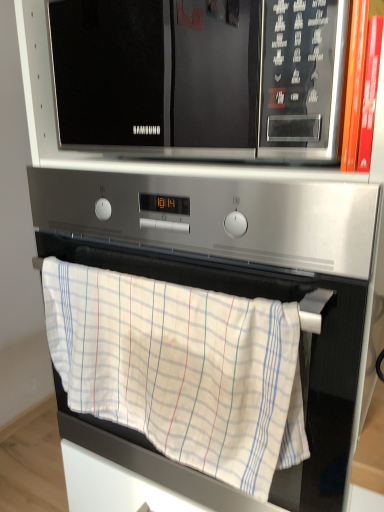
The height and width of the screenshot is (512, 384). Describe the element at coordinates (239, 270) in the screenshot. I see `satin silver oven at center` at that location.

The image size is (384, 512). What are the coordinates of `satin silver oven at center` in the screenshot? It's located at (239, 270).

The image size is (384, 512). Find the location of `black glossy microwave at upper center`. black glossy microwave at upper center is located at coordinates (202, 77).

Describe the element at coordinates (202, 77) in the screenshot. I see `black glossy microwave at upper center` at that location.

In order to face black glossy microwave at upper center, should I rotate leftwards or rightwards?

You should look right and rotate roughly 3.825 degrees.

Image resolution: width=384 pixels, height=512 pixels. Identify the location of satin silver oven at center. (239, 270).

Is black glossy microwave at upper center to the left of satin silver oven at center from the viewer's perspective?

Correct, you'll find black glossy microwave at upper center to the left of satin silver oven at center.

Considering the relative positions of black glossy microwave at upper center and satin silver oven at center in the image provided, is black glossy microwave at upper center in front of satin silver oven at center?

Yes, black glossy microwave at upper center is closer to the viewer.

Considering the points (121, 73) and (266, 238), which point is behind, point (121, 73) or point (266, 238)?

The point (121, 73) is more distant.

From the image's perspective, between black glossy microwave at upper center and satin silver oven at center, which one is located above?

black glossy microwave at upper center is shown above in the image.

From a real-world perspective, which is physically above, black glossy microwave at upper center or satin silver oven at center?

In real-world perspective, black glossy microwave at upper center is above.

Does black glossy microwave at upper center have a lesser width compared to satin silver oven at center?

Yes, black glossy microwave at upper center is thinner than satin silver oven at center.

Between black glossy microwave at upper center and satin silver oven at center, which one has less height?

black glossy microwave at upper center is shorter.

Does black glossy microwave at upper center have a larger size compared to satin silver oven at center?

No.

Is black glossy microwave at upper center inside or outside of satin silver oven at center?

black glossy microwave at upper center is located beyond the bounds of satin silver oven at center.

Are black glossy microwave at upper center and satin silver oven at center far apart?

Actually, black glossy microwave at upper center and satin silver oven at center are a little close together.

Is black glossy microwave at upper center facing away from satin silver oven at center?

No, black glossy microwave at upper center's orientation is not away from satin silver oven at center.

How different are the orientations of black glossy microwave at upper center and satin silver oven at center in degrees?

The facing directions of black glossy microwave at upper center and satin silver oven at center are 0.814 degrees apart.

I want to click on oven behind the black glossy microwave at upper center, so click(239, 270).

Which object is positioned more to the right, satin silver oven at center or black glossy microwave at upper center?

From the viewer's perspective, satin silver oven at center appears more on the right side.

Consider the image. Considering the positions of objects satin silver oven at center and black glossy microwave at upper center in the image provided, who is behind, satin silver oven at center or black glossy microwave at upper center?

satin silver oven at center.

Is point (161, 241) more distant than point (303, 136)?

Yes, it is.

From the picture: From the image's perspective, relative to black glossy microwave at upper center, is satin silver oven at center above or below?

From the image's perspective, satin silver oven at center appears below black glossy microwave at upper center.

From a real-world perspective, is satin silver oven at center beneath black glossy microwave at upper center?

A: Indeed, from a real-world perspective, satin silver oven at center is positioned beneath black glossy microwave at upper center.

Which of these two, satin silver oven at center or black glossy microwave at upper center, is wider?

satin silver oven at center.

Who is taller, satin silver oven at center or black glossy microwave at upper center?

satin silver oven at center.

Who is smaller, satin silver oven at center or black glossy microwave at upper center?

Smaller between the two is black glossy microwave at upper center.

Which is correct: satin silver oven at center is inside black glossy microwave at upper center, or outside of it?

satin silver oven at center is not enclosed by black glossy microwave at upper center.

Is satin silver oven at center placed right next to black glossy microwave at upper center?

No, satin silver oven at center is not with black glossy microwave at upper center.

Is satin silver oven at center positioned with its back to black glossy microwave at upper center?

No.

How different are the orientations of satin silver oven at center and black glossy microwave at upper center in degrees?

0.814 degrees separate the facing orientations of satin silver oven at center and black glossy microwave at upper center.

Measure the distance from satin silver oven at center to black glossy microwave at upper center.

They are 17.94 centimeters apart.

In order to click on microwave oven above the satin silver oven at center (from a real-world perspective) in this screenshot , I will do `click(202, 77)`.

Find the location of a particular element. The image size is (384, 512). microwave oven that appears in front of the satin silver oven at center is located at coordinates (202, 77).

This screenshot has height=512, width=384. What are the coordinates of `oven below the black glossy microwave at upper center (from the image's perspective)` in the screenshot? It's located at 239,270.